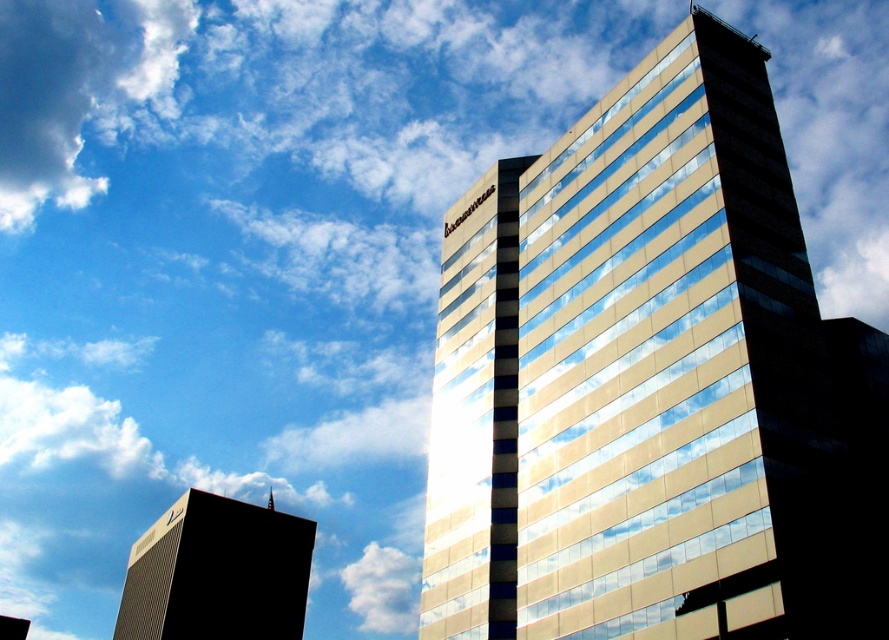
Who is higher up, gold reflective glass building at center or black glass tower at lower left?

gold reflective glass building at center

Is gold reflective glass building at center closer to camera compared to black glass tower at lower left?

Yes, gold reflective glass building at center is in front of black glass tower at lower left.

Who is more distant from viewer, (594, 241) or (209, 625)?

Point (209, 625)

The image size is (889, 640). What are the coordinates of `gold reflective glass building at center` in the screenshot? It's located at (627, 368).

This screenshot has width=889, height=640. Describe the element at coordinates (217, 572) in the screenshot. I see `black glass tower at lower left` at that location.

Who is more forward, (219, 520) or (353, 596)?

Point (219, 520)

Where is `black glass tower at lower left`? Image resolution: width=889 pixels, height=640 pixels. black glass tower at lower left is located at coordinates tap(217, 572).

Can you confirm if gold reflective glass building at center is taller than white fluffy cloud at upper left?

In fact, gold reflective glass building at center may be shorter than white fluffy cloud at upper left.

Is gold reflective glass building at center wider than white fluffy cloud at upper left?

No, gold reflective glass building at center is not wider than white fluffy cloud at upper left.

Is point (711, 528) closer to camera compared to point (174, 76)?

Yes, it is.

You are a GUI agent. You are given a task and a screenshot of the screen. Output one action in this format:
    pyautogui.click(x=<x>, y=<y>)
    Task: Click on the gold reflective glass building at center
    The width and height of the screenshot is (889, 640).
    Given the screenshot: What is the action you would take?
    pyautogui.click(x=627, y=368)